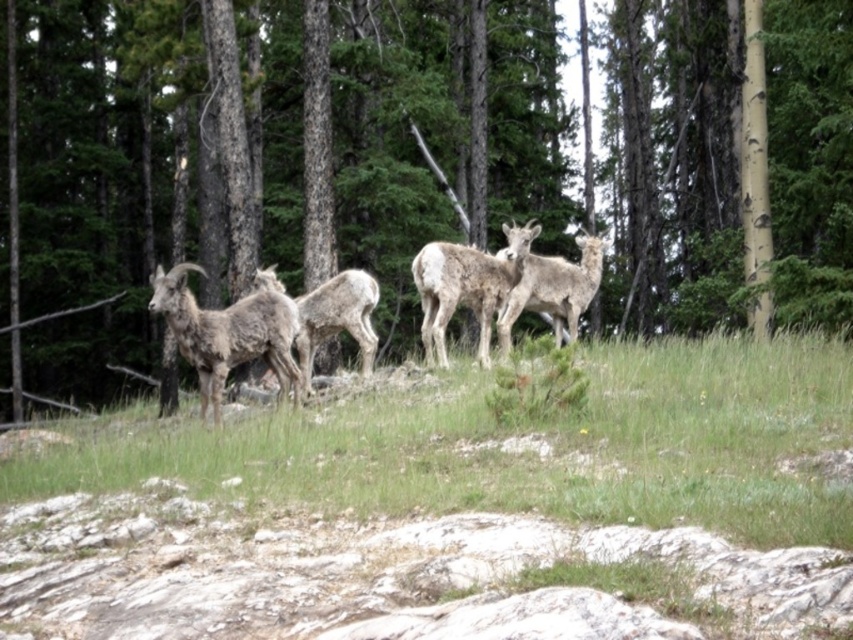
Who is more forward, [175,266] or [364,301]?

Point [364,301] is in front.

Which is above, gray woolly goat at center or brown woolen goat at center?

brown woolen goat at center is above.

Describe the element at coordinates (227, 333) in the screenshot. Image resolution: width=853 pixels, height=640 pixels. I see `gray woolly goat at center` at that location.

At what (x,y) coordinates should I click in order to perform the action: click on gray woolly goat at center. Please return your answer as a coordinate pair (x, y). The width and height of the screenshot is (853, 640). Looking at the image, I should click on (227, 333).

Looking at this image, which of these two, brown textured tree at center or brown woolen goat at center, stands shorter?

brown woolen goat at center

Does brown textured tree at center have a lesser height compared to brown woolen goat at center?

No.

Identify the location of brown textured tree at center. This screenshot has height=640, width=853. (410, 163).

At what (x,y) coordinates should I click in order to perform the action: click on brown textured tree at center. Please return your answer as a coordinate pair (x, y). Looking at the image, I should click on (410, 163).

Can you confirm if fuzzy white goat at center is smaller than brown woolen goat at center?

Yes, fuzzy white goat at center is smaller than brown woolen goat at center.

Who is shorter, fuzzy white goat at center or brown woolen goat at center?

Standing shorter between the two is brown woolen goat at center.

Is point (552, 294) closer to camera compared to point (310, 378)?

Yes, point (552, 294) is closer to viewer.

The height and width of the screenshot is (640, 853). In order to click on fuzzy white goat at center in this screenshot , I will do `click(554, 289)`.